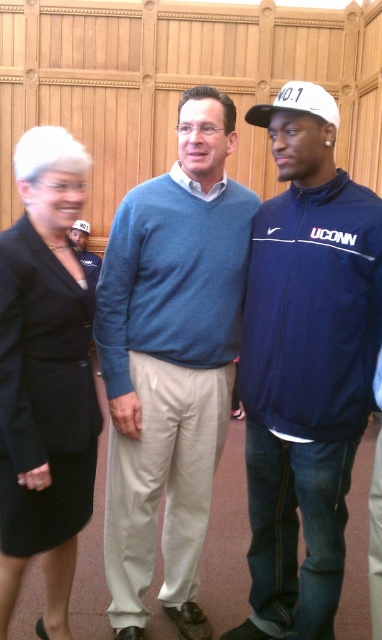
You are a photographer setting up a tripod to capture the three people in the scene. The tripod has a maximum reach of 4 meters. Can you position the tripod so that both the navy blue jacket at center and the matte blue sweater at center are within the camera frame without moving the subjects? Explain your reasoning.

The navy blue jacket at center and the matte blue sweater at center are 3.97 meters apart. Since the tripod has a maximum reach of 4 meters, it can accommodate the distance between them, so yes, the photographer can position the tripod to include both within the frame without moving the subjects.

You are standing in the same room as the three people in the image. If you want to walk from the point marked as point (x=260, y=358) to the point marked as point (x=90, y=268), which direction should you move relative to the camera?

You should move towards the bottom left direction relative to the camera because point (x=260, y=358) is in front of point (x=90, y=268), indicating that moving towards the bottom left would lead you closer to the target point.